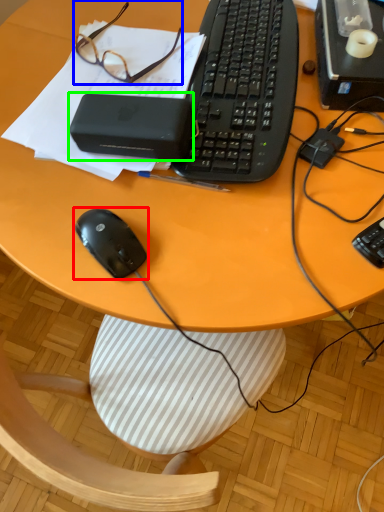
Question: Which object is positioned farthest from mouse (highlighted by a red box)? Select from glasses (highlighted by a blue box) and gadget (highlighted by a green box).

Choices:
 (A) glasses
 (B) gadget

Answer: (A)